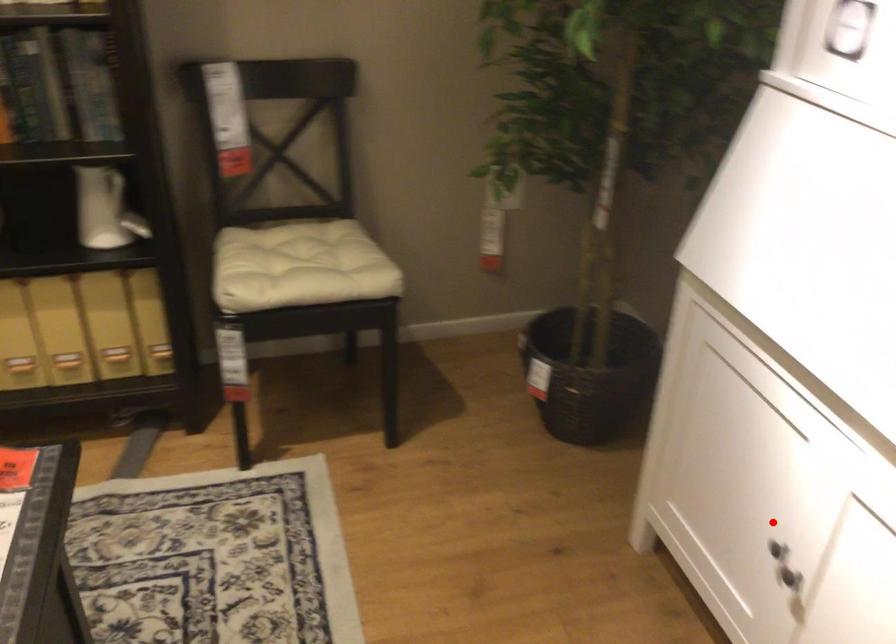
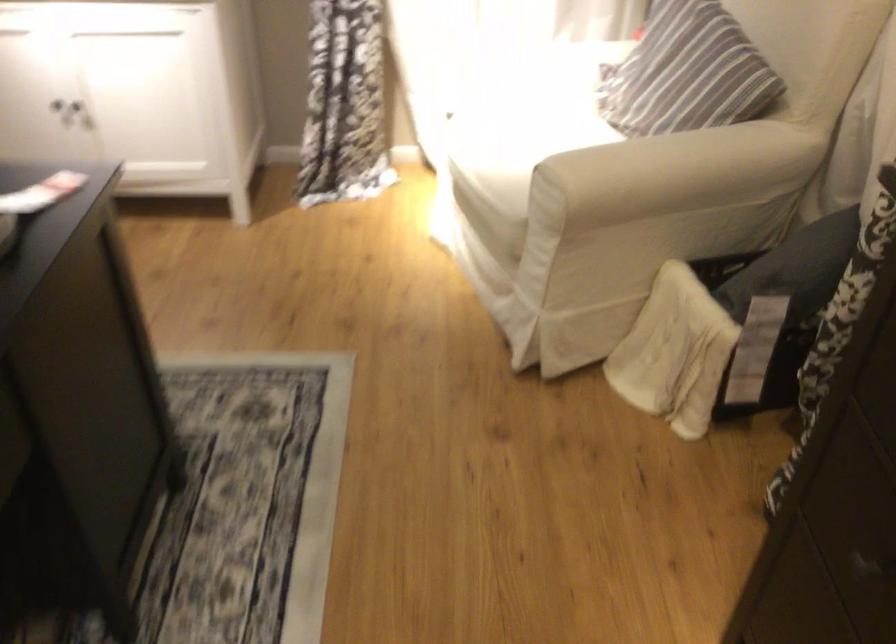
Question: A red point is marked in image1. In image2, is the corresponding 3D point closer to the camera or farther? Reply with the corresponding letter.

Choices:
 (A) The corresponding 3D point is closer.
 (B) The corresponding 3D point is farther.

Answer: (B)